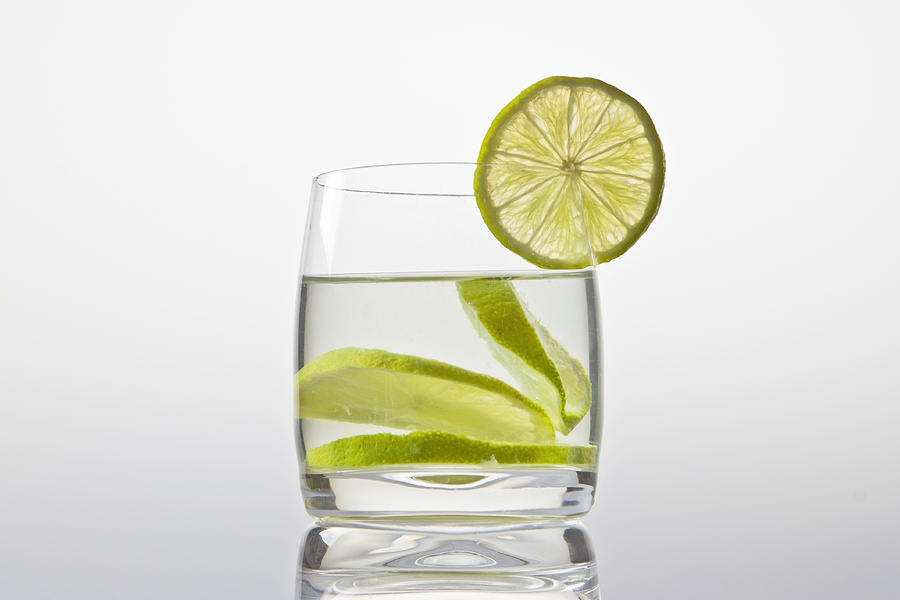
You are a GUI agent. You are given a task and a screenshot of the screen. Output one action in this format:
    pyautogui.click(x=<x>, y=<y>)
    Task: Click on the limes inside of glass
    
    Given the screenshot: What is the action you would take?
    pyautogui.click(x=540, y=355), pyautogui.click(x=481, y=411), pyautogui.click(x=468, y=448)